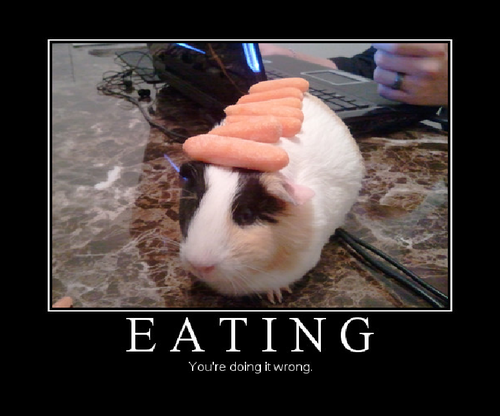
Locate an element on the screen. table top is located at coordinates (116, 195), (415, 198).